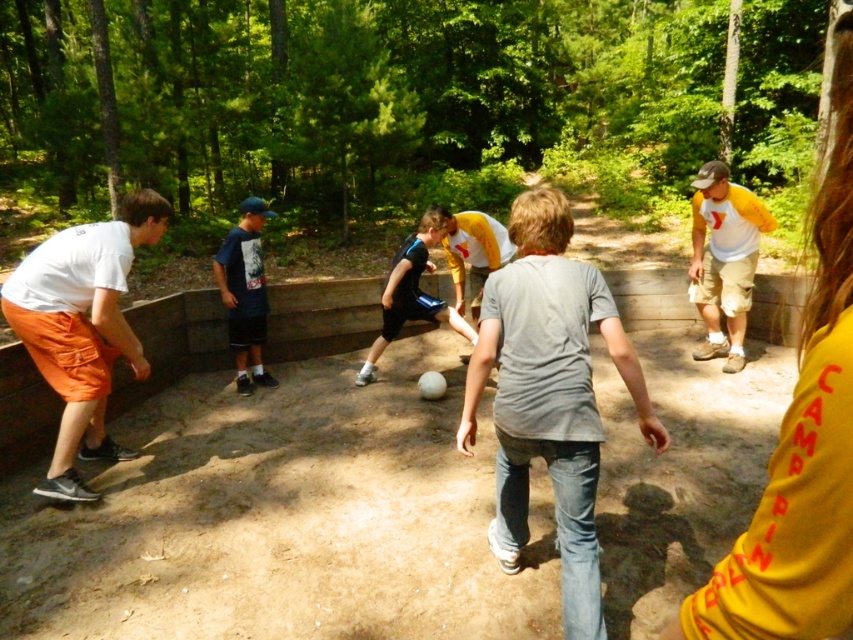
Based on the photo, between gray cotton shirt at center and white cotton shirt at left, which one is positioned higher?

white cotton shirt at left

Which of these two, gray cotton shirt at center or white cotton shirt at left, stands shorter?

With less height is gray cotton shirt at center.

Which is behind, point (635, 388) or point (114, 442)?

Point (114, 442)

Locate an element on the screen. The width and height of the screenshot is (853, 640). gray cotton shirt at center is located at coordinates (549, 396).

The image size is (853, 640). What do you see at coordinates (82, 328) in the screenshot?
I see `white cotton shirt at left` at bounding box center [82, 328].

Based on the photo, can you confirm if white cotton shirt at left is wider than black matte shorts at center?

Incorrect, white cotton shirt at left's width does not surpass black matte shorts at center's.

Which is in front, point (94, 240) or point (358, 378)?

Point (94, 240) is more forward.

Locate an element on the screen. This screenshot has width=853, height=640. white cotton shirt at left is located at coordinates (82, 328).

Is gray cotton shirt at center smaller than dark blue t-shirt at center?

Incorrect, gray cotton shirt at center is not smaller in size than dark blue t-shirt at center.

Which is behind, point (474, 385) or point (233, 333)?

Point (233, 333)

Where is `gray cotton shirt at center`? gray cotton shirt at center is located at coordinates (549, 396).